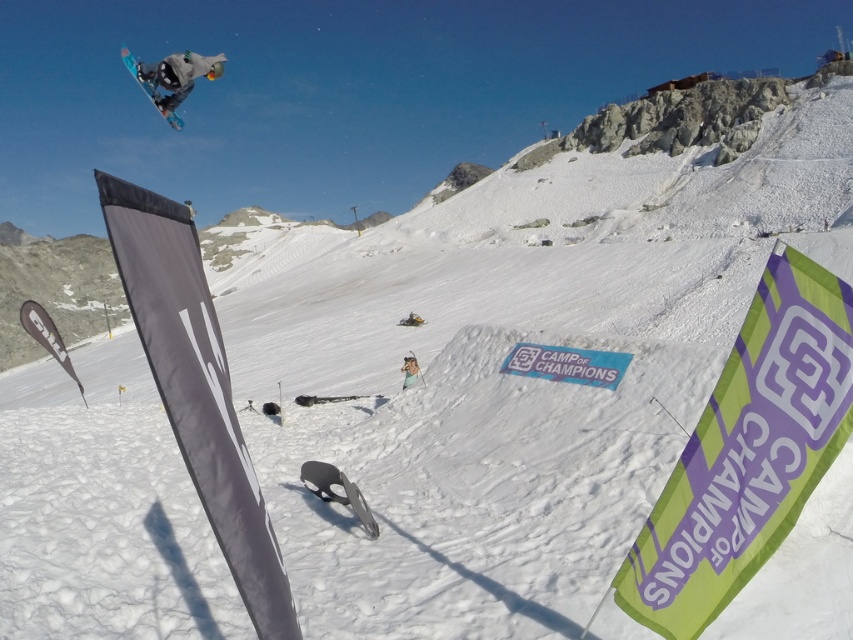
Consider the image. Is shiny blue snowboard at upper left positioned before white matte snowboarder at center?

No, shiny blue snowboard at upper left is behind white matte snowboarder at center.

Measure the distance between shiny blue snowboard at upper left and camera.

shiny blue snowboard at upper left and camera are 19.90 meters apart from each other.

This screenshot has width=853, height=640. In order to click on shiny blue snowboard at upper left in this screenshot , I will do pyautogui.click(x=149, y=88).

Does point (171, 58) lie behind point (409, 378)?

Yes.

Who is shorter, gray matte snowboarder at upper left or white matte snowboarder at center?

white matte snowboarder at center is shorter.

Is point (158, 83) closer to viewer compared to point (412, 381)?

No, (158, 83) is behind (412, 381).

Locate an element on the screen. Image resolution: width=853 pixels, height=640 pixels. gray matte snowboarder at upper left is located at coordinates (177, 76).

Does gray matte snowboarder at upper left have a lesser width compared to shiny blue snowboard at upper left?

Yes, gray matte snowboarder at upper left is thinner than shiny blue snowboard at upper left.

Between gray matte snowboarder at upper left and shiny blue snowboard at upper left, which one is positioned higher?

Positioned higher is shiny blue snowboard at upper left.

Locate an element on the screen. gray matte snowboarder at upper left is located at coordinates (177, 76).